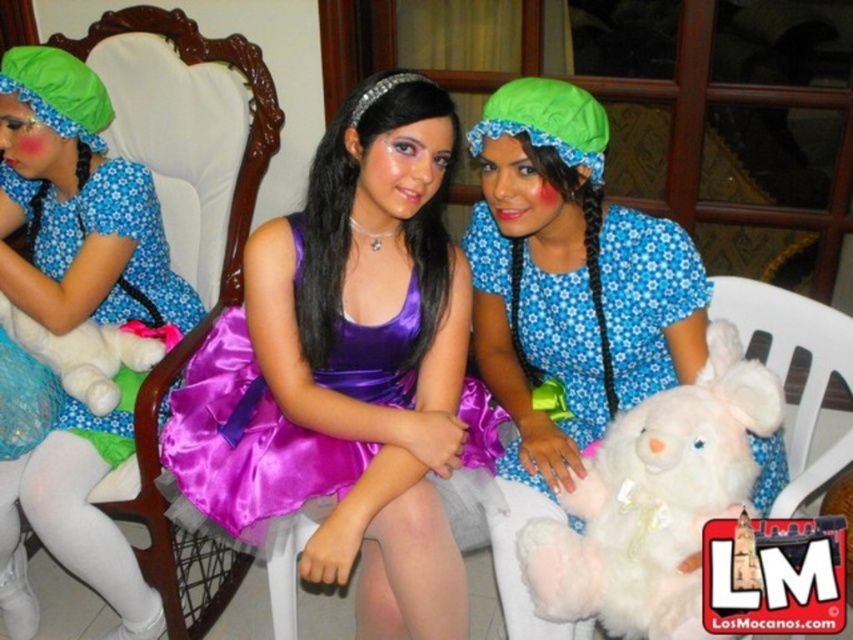
Question: Is matte blue dress at center bigger than white plush bear at center?

Choices:
 (A) no
 (B) yes

Answer: (B)

Question: Is matte blue dress at left smaller than white plush bear at center?

Choices:
 (A) yes
 (B) no

Answer: (B)

Question: From the image, what is the correct spatial relationship of matte blue dress at left in relation to white plush bear at center?

Choices:
 (A) left
 (B) right

Answer: (A)

Question: Which object is farther from the camera taking this photo?

Choices:
 (A) purple satin dress at center
 (B) matte blue dress at center

Answer: (B)

Question: Estimate the real-world distances between objects in this image. Which object is closer to the matte blue dress at center?

Choices:
 (A) purple satin dress at center
 (B) matte blue dress at left

Answer: (A)

Question: Which of these objects is positioned closest to the purple satin dress at center?

Choices:
 (A) matte blue dress at center
 (B) white plush bear at center

Answer: (A)